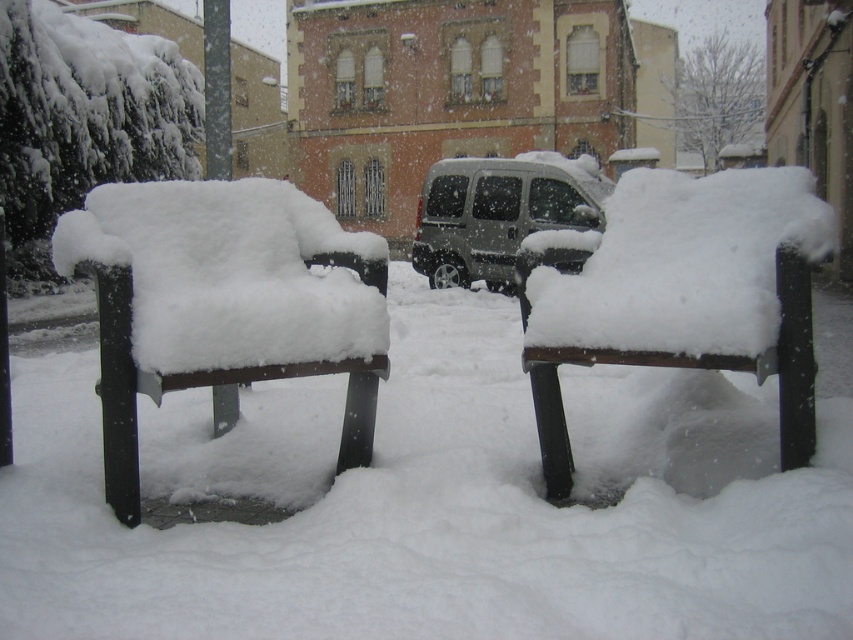
Question: Among these objects, which one is nearest to the camera?

Choices:
 (A) wooden park bench at center
 (B) metallic silver van at center

Answer: (A)

Question: Considering the relative positions of wooden park bench at left and metallic silver van at center in the image provided, where is wooden park bench at left located with respect to metallic silver van at center?

Choices:
 (A) below
 (B) above

Answer: (A)

Question: Does wooden park bench at left appear on the right side of metallic silver van at center?

Choices:
 (A) yes
 (B) no

Answer: (B)

Question: Is wooden park bench at left further to camera compared to metallic silver van at center?

Choices:
 (A) no
 (B) yes

Answer: (A)

Question: Which point appears farthest from the camera in this image?

Choices:
 (A) (671, 320)
 (B) (137, 307)
 (C) (502, 204)

Answer: (C)

Question: Among these points, which one is nearest to the camera?

Choices:
 (A) (419, 240)
 (B) (532, 298)

Answer: (B)